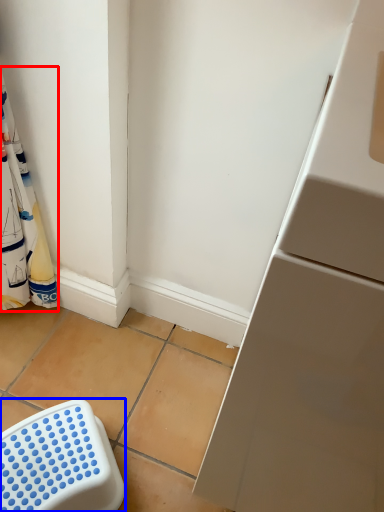
Question: Which object is further to the camera taking this photo, laundry (highlighted by a red box) or furniture (highlighted by a blue box)?

Choices:
 (A) laundry
 (B) furniture

Answer: (B)